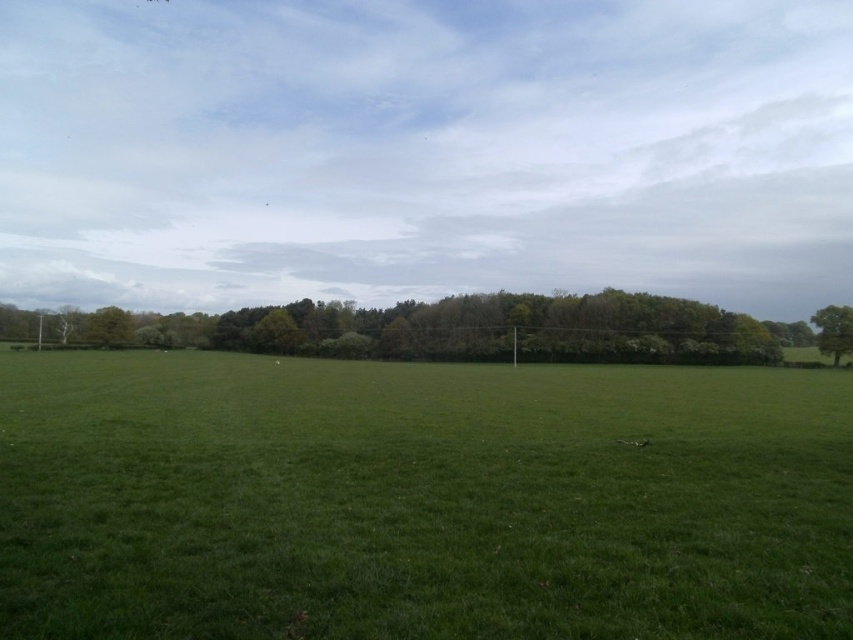
Question: Is green grass at center below green leafy trees at center?

Choices:
 (A) no
 (B) yes

Answer: (B)

Question: Is green grass at center to the left of green leafy tree at right from the viewer's perspective?

Choices:
 (A) no
 (B) yes

Answer: (B)

Question: Does green leafy trees at center have a greater width compared to green leafy tree at right?

Choices:
 (A) yes
 (B) no

Answer: (A)

Question: Among these objects, which one is farthest from the camera?

Choices:
 (A) green leafy trees at center
 (B) green grass at center
 (C) green leafy tree at right

Answer: (C)

Question: Which point appears closest to the camera in this image?

Choices:
 (A) (444, 403)
 (B) (822, 342)

Answer: (A)

Question: Which of these objects is positioned closest to the green leafy trees at center?

Choices:
 (A) green grass at center
 (B) green leafy tree at right

Answer: (B)